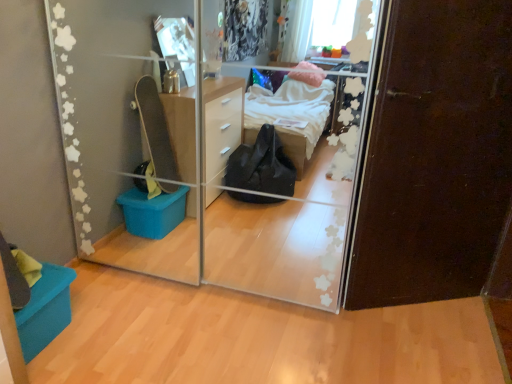
Question: From their relative heights in the image, would you say dark brown wood door at right is taller or shorter than teal fabric storage box at lower left?

Choices:
 (A) short
 (B) tall

Answer: (B)

Question: In the image, is dark brown wood door at right on the left side or the right side of teal fabric storage box at lower left?

Choices:
 (A) left
 (B) right

Answer: (B)

Question: Considering the real-world distances, which object is farthest from the dark brown wood door at right?

Choices:
 (A) teal fabric storage box at lower left
 (B) transparent glass door at center

Answer: (A)

Question: Estimate the real-world distances between objects in this image. Which object is closer to the teal fabric storage box at lower left?

Choices:
 (A) transparent glass door at center
 (B) dark brown wood door at right

Answer: (A)